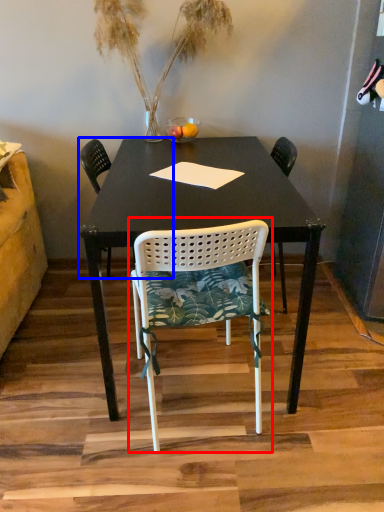
Question: Which point is further to the camera, chair (highlighted by a red box) or chair (highlighted by a blue box)?

Choices:
 (A) chair
 (B) chair

Answer: (B)